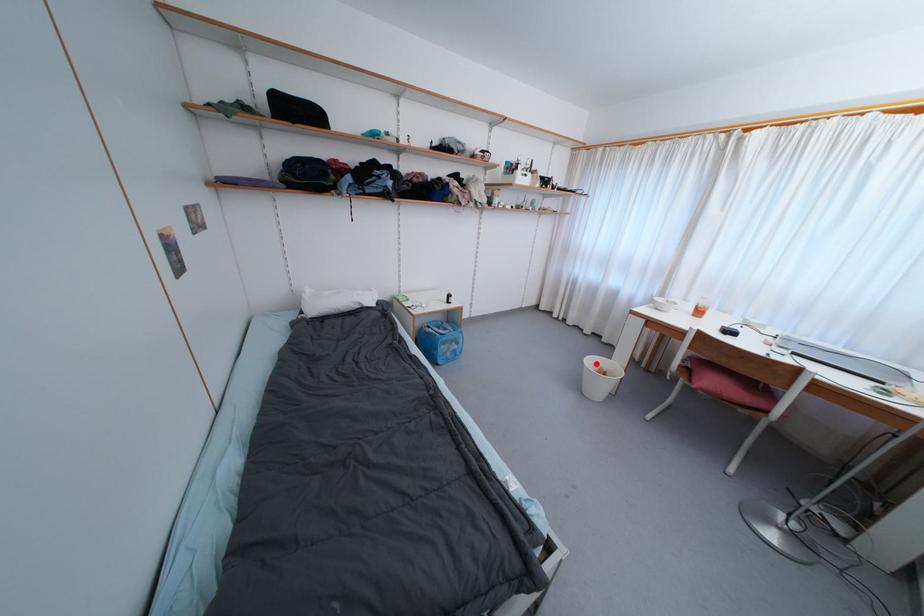
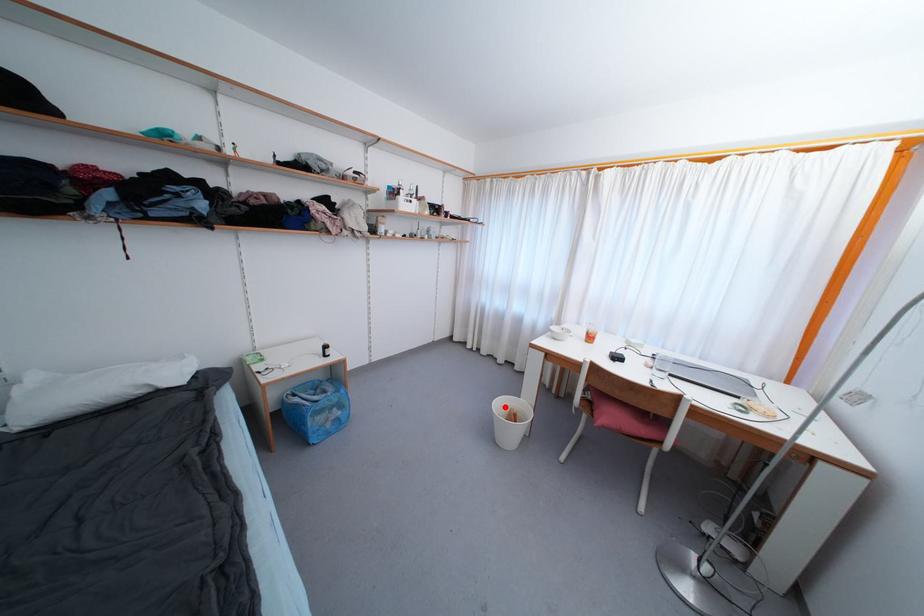
I am providing you with two images of the same scene from different viewpoints. A red point is marked on the first image and another point is marked on the second image. Do the highlighted points in image1 and image2 indicate the same real-world spot?

Yes